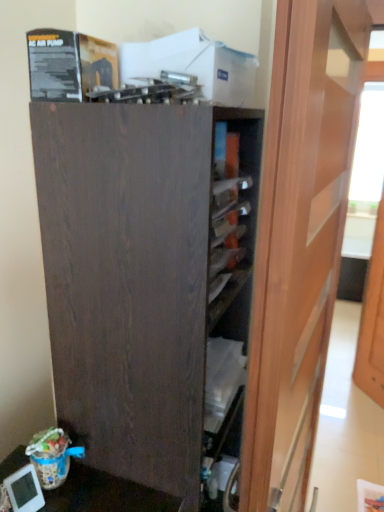
Question: Does matte wood door at center, the 1th door viewed from the left, contain dark wood cupboard at center?

Choices:
 (A) yes
 (B) no

Answer: (B)

Question: From the image's perspective, is matte wood door at center, the 1th door viewed from the left, located beneath dark wood cupboard at center?

Choices:
 (A) no
 (B) yes

Answer: (A)

Question: Is matte wood door at center, the first door viewed from the front, in front of dark wood cupboard at center?

Choices:
 (A) no
 (B) yes

Answer: (B)

Question: Can you confirm if matte wood door at center, the first door viewed from the front, is smaller than dark wood cupboard at center?

Choices:
 (A) yes
 (B) no

Answer: (A)

Question: Is matte wood door at center, the 2th door positioned from the right, outside of dark wood cupboard at center?

Choices:
 (A) no
 (B) yes

Answer: (B)

Question: Do you think wooden door at right, arranged as the 2th door when viewed from the left, is within dark wood cupboard at center, or outside of it?

Choices:
 (A) outside
 (B) inside

Answer: (A)

Question: Is point (365, 303) closer or farther from the camera than point (74, 385)?

Choices:
 (A) closer
 (B) farther

Answer: (B)

Question: Is wooden door at right, marked as the 1th door in a back-to-front arrangement, to the left or to the right of dark wood cupboard at center in the image?

Choices:
 (A) right
 (B) left

Answer: (A)

Question: From a real-world perspective, is wooden door at right, marked as the second door in a front-to-back arrangement, physically located above or below dark wood cupboard at center?

Choices:
 (A) below
 (B) above

Answer: (A)

Question: Is wooden door at right, marked as the second door in a front-to-back arrangement, wider or thinner than matte wood door at center, the 2th door positioned from the right?

Choices:
 (A) thin
 (B) wide

Answer: (A)

Question: Looking at the image, does wooden door at right, marked as the 1th door in a back-to-front arrangement, seem bigger or smaller compared to matte wood door at center, arranged as the second door when viewed from the back?

Choices:
 (A) small
 (B) big

Answer: (A)

Question: Relative to matte wood door at center, the 2th door positioned from the right, is wooden door at right, arranged as the 2th door when viewed from the left, in front or behind?

Choices:
 (A) front
 (B) behind

Answer: (B)

Question: Considering the relative positions of wooden door at right, marked as the second door in a front-to-back arrangement, and matte wood door at center, the 2th door positioned from the right, in the image provided, is wooden door at right, marked as the second door in a front-to-back arrangement, to the left or to the right of matte wood door at center, the 2th door positioned from the right,?

Choices:
 (A) right
 (B) left

Answer: (A)

Question: From the image's perspective, is matte wood door at center, the 1th door viewed from the left, positioned above or below dark wood cupboard at center?

Choices:
 (A) below
 (B) above

Answer: (B)

Question: Is matte wood door at center, the 1th door viewed from the left, spatially inside dark wood cupboard at center, or outside of it?

Choices:
 (A) inside
 (B) outside

Answer: (B)